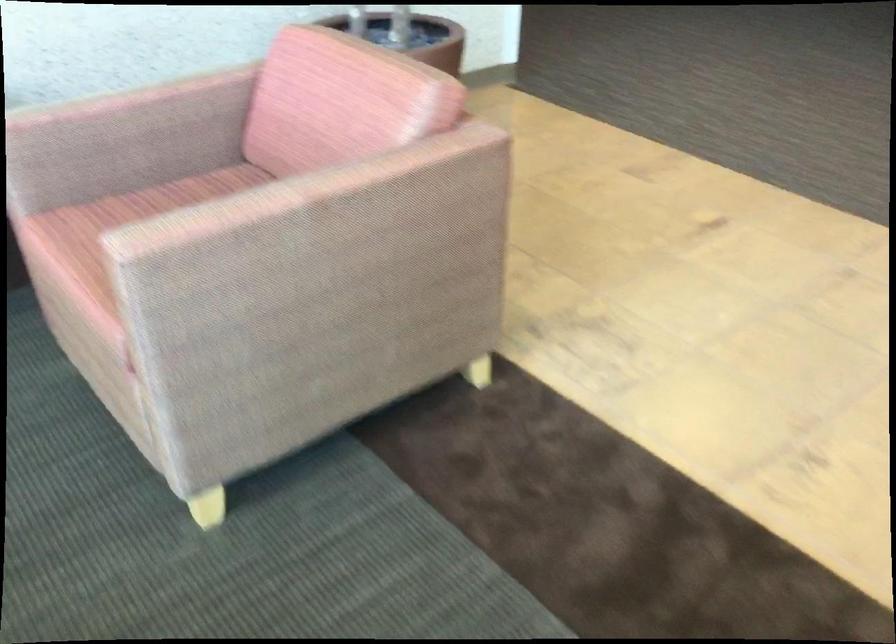
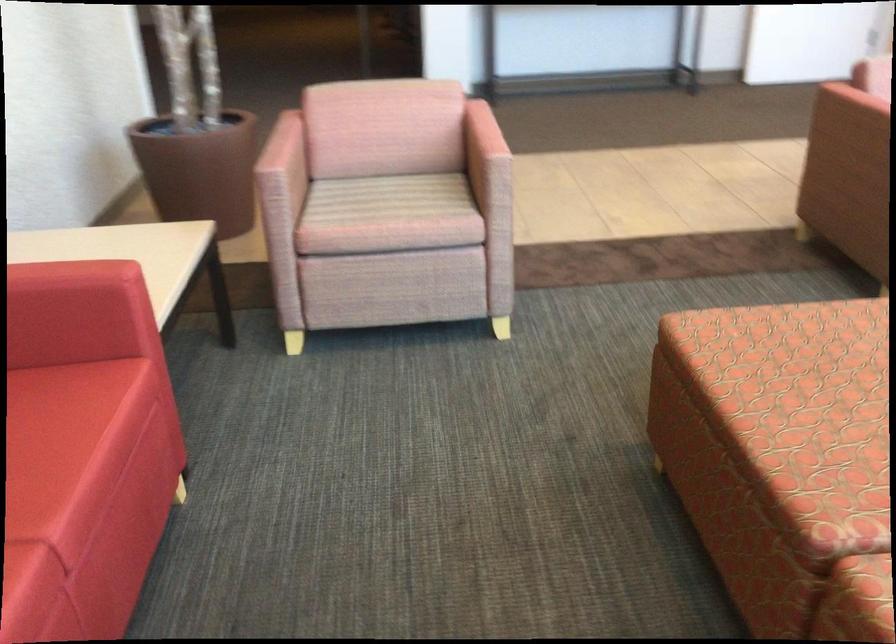
The point at [243,203] is marked in the first image. Where is the corresponding point in the second image?

(481, 133)